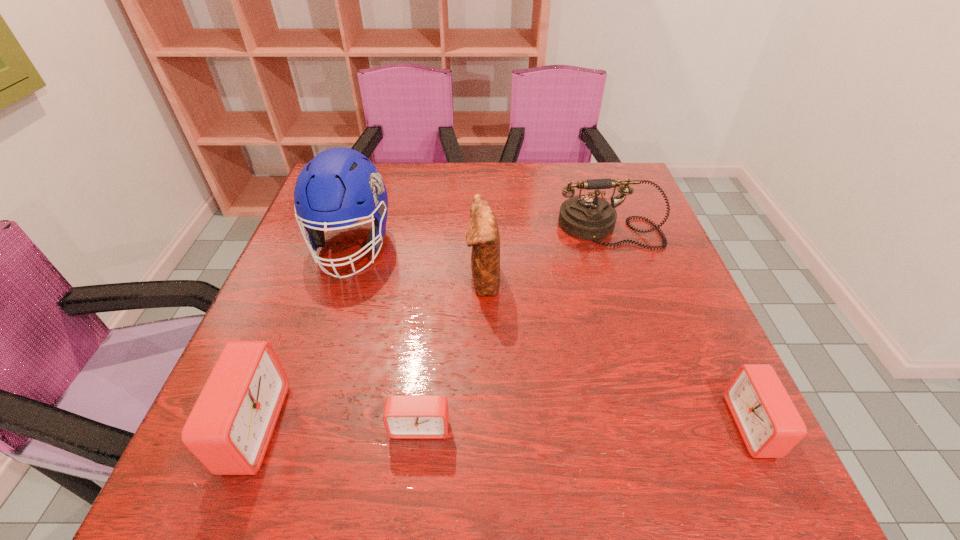
This screenshot has height=540, width=960. I want to click on vacant space at the near right corner of the desktop, so click(x=689, y=390).

Locate an element on the screen. This screenshot has width=960, height=540. free point between the telephone and the fourth object from right to left is located at coordinates (514, 327).

Where is `free spot between the second shortest alarm clock and the leftmost alarm clock`? This screenshot has height=540, width=960. free spot between the second shortest alarm clock and the leftmost alarm clock is located at coordinates (502, 427).

What are the coordinates of `free area in between the shortest object and the leftmost alarm clock` in the screenshot? It's located at (336, 427).

Locate an element on the screen. free point between the telephone and the fifth tallest object is located at coordinates (680, 327).

Image resolution: width=960 pixels, height=540 pixels. Find the location of `empty location between the tallest object and the shortest object`. empty location between the tallest object and the shortest object is located at coordinates (386, 336).

Where is `free space between the tallest alarm clock and the second shortest alarm clock`? free space between the tallest alarm clock and the second shortest alarm clock is located at coordinates (502, 427).

At what (x,y) coordinates should I click in order to perform the action: click on vacant space that is in between the football helmet and the clutch bag. Please return your answer as a coordinate pair (x, y). This screenshot has height=540, width=960. Looking at the image, I should click on (418, 262).

The height and width of the screenshot is (540, 960). In order to click on empty space between the second tallest alarm clock and the shortest alarm clock in this screenshot , I will do pos(586,426).

At what (x,y) coordinates should I click in order to perform the action: click on free space between the telephone and the fifth tallest object. Please return your answer as a coordinate pair (x, y). Looking at the image, I should click on (680, 327).